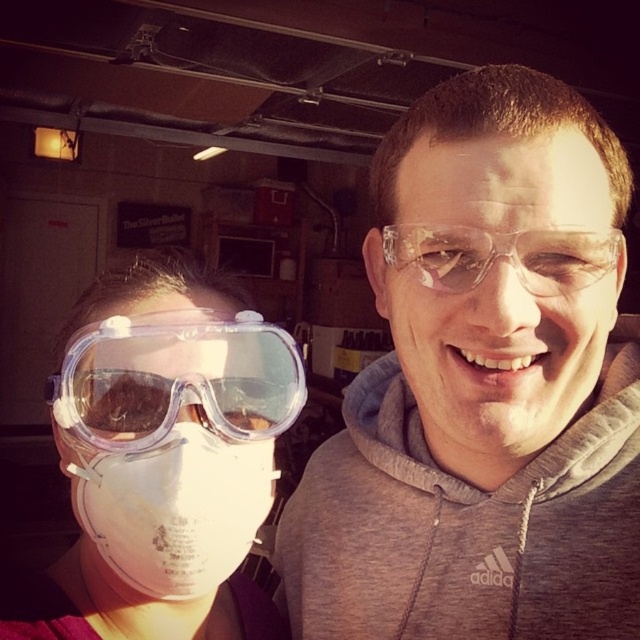
Question: Does clear plastic goggles at left appear under transparent plastic goggles at left?

Choices:
 (A) no
 (B) yes

Answer: (B)

Question: Which point is farther to the camera?

Choices:
 (A) clear plastic goggles at left
 (B) transparent plastic goggles at left
 (C) clear plastic glasses at center

Answer: (B)

Question: Is clear plastic glasses at center further to camera compared to transparent plastic goggles at left?

Choices:
 (A) yes
 (B) no

Answer: (B)

Question: Estimate the real-world distances between objects in this image. Which object is farther from the clear plastic goggles at left?

Choices:
 (A) transparent plastic goggles at left
 (B) clear plastic glasses at center

Answer: (B)

Question: Can you confirm if clear plastic glasses at center is thinner than transparent plastic goggles at left?

Choices:
 (A) yes
 (B) no

Answer: (B)

Question: Which object is positioned closest to the clear plastic glasses at center?

Choices:
 (A) clear plastic goggles at left
 (B) transparent plastic goggles at left

Answer: (A)